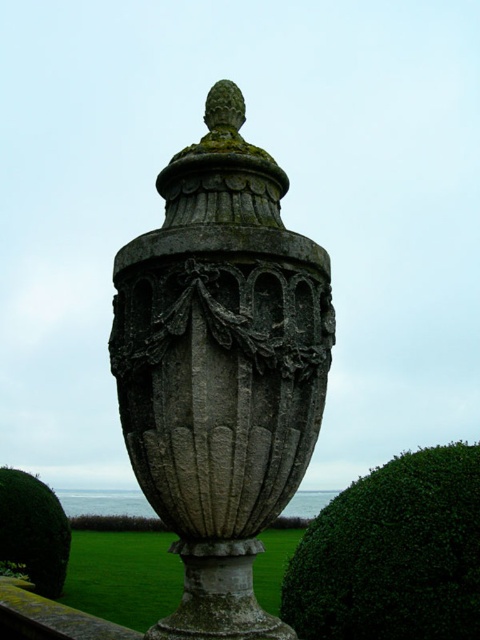
You are standing in front of the gray stone urn at center. If you walk directly towards the point marked at coordinates 0.575, 0.460, will you be moving towards the urn?

Yes, because the gray stone urn at center is located at point (220,368), so walking towards those coordinates will lead you directly to the urn.

You are a landscape designer planning to place a new decorative statue in the garden. You have a small statue that is 1 meter wide. The gray stone urn at center and the green leafy bush at lower left are already in the garden. Based on their sizes, which object would be more appropriate to place the statue next to for a balanced look?

The gray stone urn at center is bigger than the green leafy bush at lower left, so placing the 1 meter wide statue next to the gray stone urn at center would create a more balanced look since they are similar in scale.